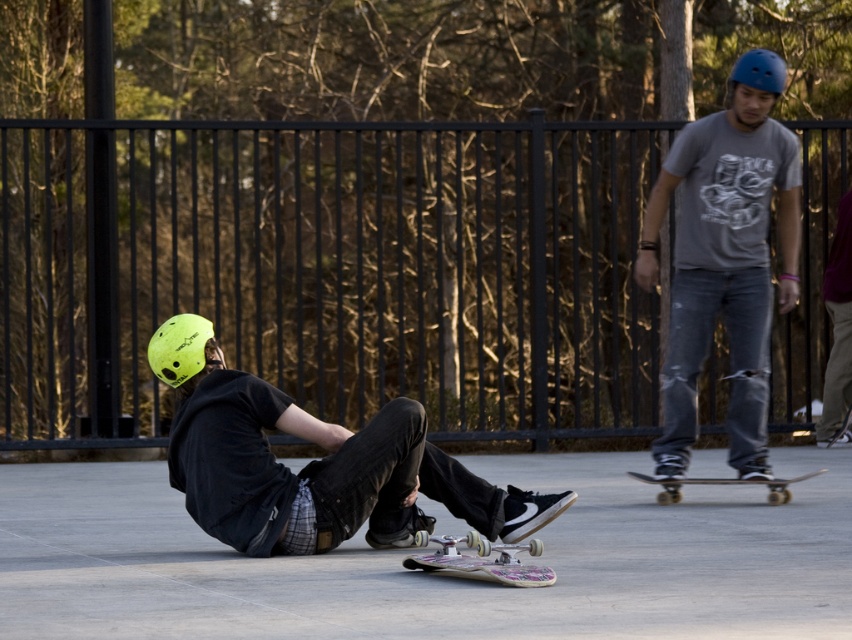
Question: Considering the relative positions of matte gray t-shirt at center and wooden skateboard at center in the image provided, where is matte gray t-shirt at center located with respect to wooden skateboard at center?

Choices:
 (A) below
 (B) above

Answer: (B)

Question: Among these objects, which one is nearest to the camera?

Choices:
 (A) floral-patterned wood skateboard at lower center
 (B) black metal fence at center
 (C) matte gray t-shirt at center

Answer: (A)

Question: Can you confirm if black metal fence at center is wider than wooden skateboard at center?

Choices:
 (A) yes
 (B) no

Answer: (A)

Question: Which object is positioned farthest from the black metal fence at center?

Choices:
 (A) floral-patterned wood skateboard at lower center
 (B) neon yellow helmet at lower left
 (C) wooden skateboard at center

Answer: (A)

Question: Is matte gray t-shirt at center thinner than floral-patterned wood skateboard at lower center?

Choices:
 (A) yes
 (B) no

Answer: (B)

Question: Which object is positioned farthest from the matte gray t-shirt at center?

Choices:
 (A) neon yellow helmet at lower left
 (B) floral-patterned wood skateboard at lower center
 (C) wooden skateboard at center
 (D) black metal fence at center

Answer: (D)